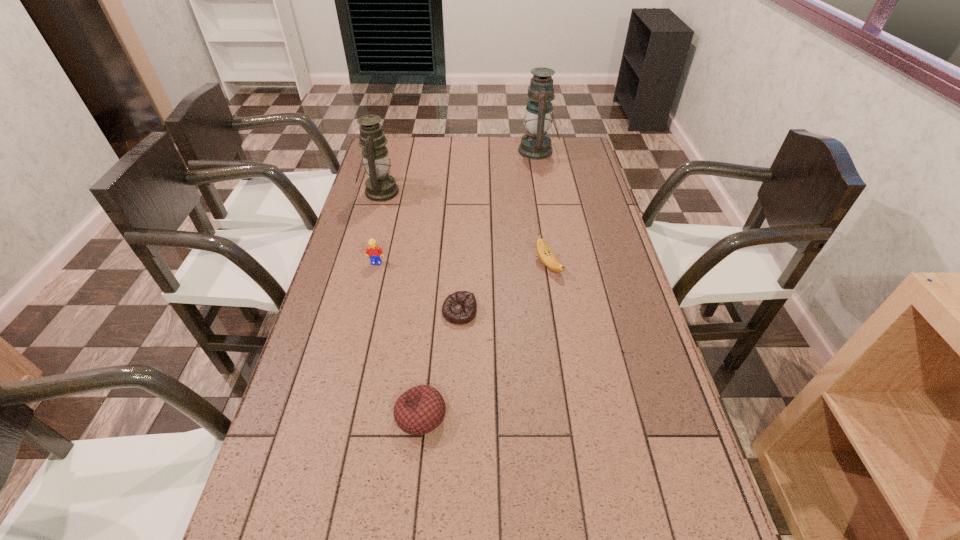
Where is `the right oil lamp`? The image size is (960, 540). the right oil lamp is located at coordinates (536, 145).

This screenshot has height=540, width=960. Find the location of `the farther oil lamp`. the farther oil lamp is located at coordinates (536, 145).

You are a GUI agent. You are given a task and a screenshot of the screen. Output one action in this format:
    pyautogui.click(x=<x>, y=<y>)
    Task: Click on the nearer oil lamp
    Image resolution: width=960 pixels, height=540 pixels.
    Given the screenshot: What is the action you would take?
    pyautogui.click(x=380, y=186)

You are a GUI agent. You are given a task and a screenshot of the screen. Output one action in this format:
    pyautogui.click(x=<x>, y=<y>)
    Task: Click on the fifth shortest object
    This screenshot has width=960, height=540.
    Given the screenshot: What is the action you would take?
    pyautogui.click(x=380, y=186)

Find the location of a particular element. Lego is located at coordinates (374, 252).

This screenshot has height=540, width=960. In order to click on banana in this screenshot , I will do `click(545, 254)`.

Where is `the taller beanbag`? This screenshot has height=540, width=960. the taller beanbag is located at coordinates (419, 410).

The image size is (960, 540). I want to click on the nearer beanbag, so click(x=419, y=410).

This screenshot has width=960, height=540. I want to click on the second nearest object, so click(460, 307).

Identify the location of the farther beanbag. The image size is (960, 540). (460, 307).